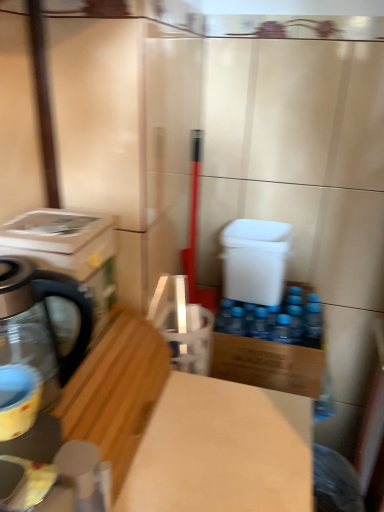
Locate an element on the screen. free point above white plastic water cooler at center (from a real-world perspective) is located at coordinates tap(261, 228).